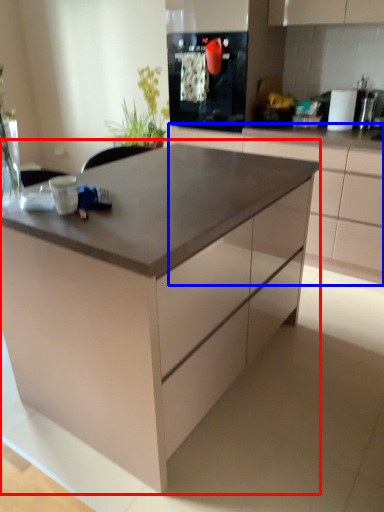
Question: Which object is further to the camera taking this photo, table (highlighted by a red box) or cabinetry (highlighted by a blue box)?

Choices:
 (A) table
 (B) cabinetry

Answer: (B)